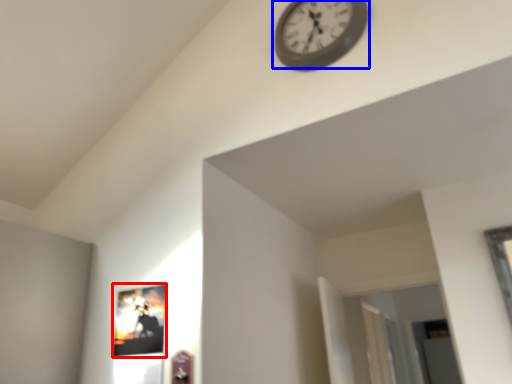
Question: Which point is further to the camera, picture frame (highlighted by a red box) or wall clock (highlighted by a blue box)?

Choices:
 (A) picture frame
 (B) wall clock

Answer: (B)